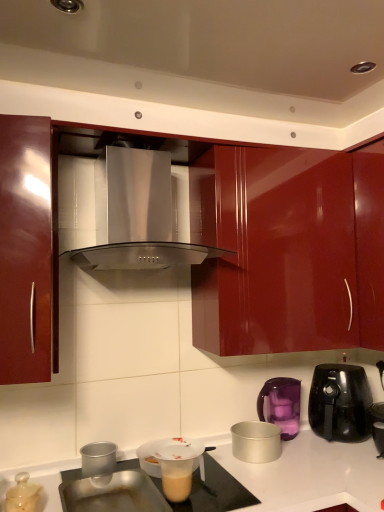
You are a GUI agent. You are given a task and a screenshot of the screen. Output one action in this format:
    pyautogui.click(x=<x>, y=<y>)
    Task: Click on the vacant space situated above silver metallic pot at lower center, positioned as the 3th kitchen appliance in left-to-right order (from a real-world perspective)
    The image size is (384, 512).
    Given the screenshot: What is the action you would take?
    pyautogui.click(x=253, y=426)